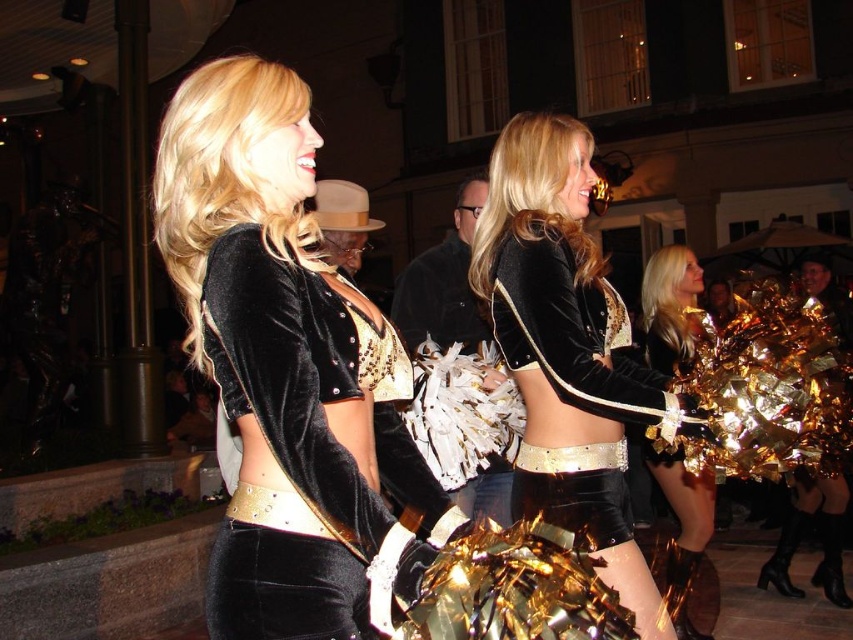
What do you see at coordinates (569, 330) in the screenshot? I see `velvet/black dress at center` at bounding box center [569, 330].

Which of these two, velvet/black dress at center or shiny gold pom-poms at center, stands taller?

With more height is shiny gold pom-poms at center.

Describe the element at coordinates (569, 330) in the screenshot. I see `velvet/black dress at center` at that location.

At what (x,y) coordinates should I click in order to perform the action: click on velvet/black dress at center. Please return your answer as a coordinate pair (x, y). Looking at the image, I should click on (569, 330).

Does point (383, 468) lie behind point (512, 280)?

No, it is in front of (512, 280).

Which of these two, velvet black jacket at center or velvet/black dress at center, stands taller?

velvet black jacket at center

Consider the image. Who is more forward, (415, 444) or (607, 499)?

Point (415, 444) is more forward.

This screenshot has width=853, height=640. Find the location of `velvet black jacket at center`. velvet black jacket at center is located at coordinates (288, 371).

Does point (657, 412) lie behind point (552, 314)?

No, (657, 412) is closer to viewer.

Looking at this image, can you confirm if velvet/goldenmaterial/texture cheerleader at center is smaller than velvet/black dress at center?

Yes.

Find the location of `velvet/goldenmaterial/texture cheerleader at center`. velvet/goldenmaterial/texture cheerleader at center is located at coordinates (567, 349).